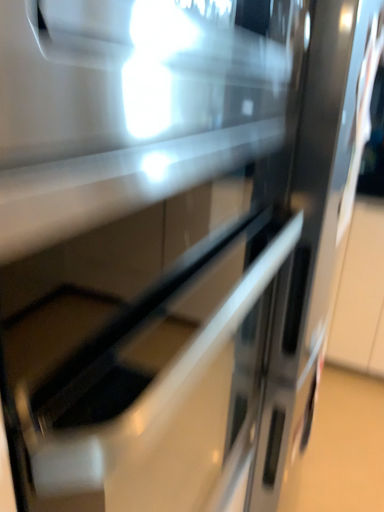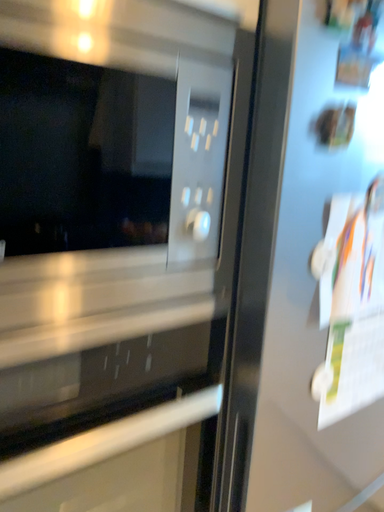
Question: Which way did the camera rotate in the video?

Choices:
 (A) rotated upward
 (B) rotated downward

Answer: (A)